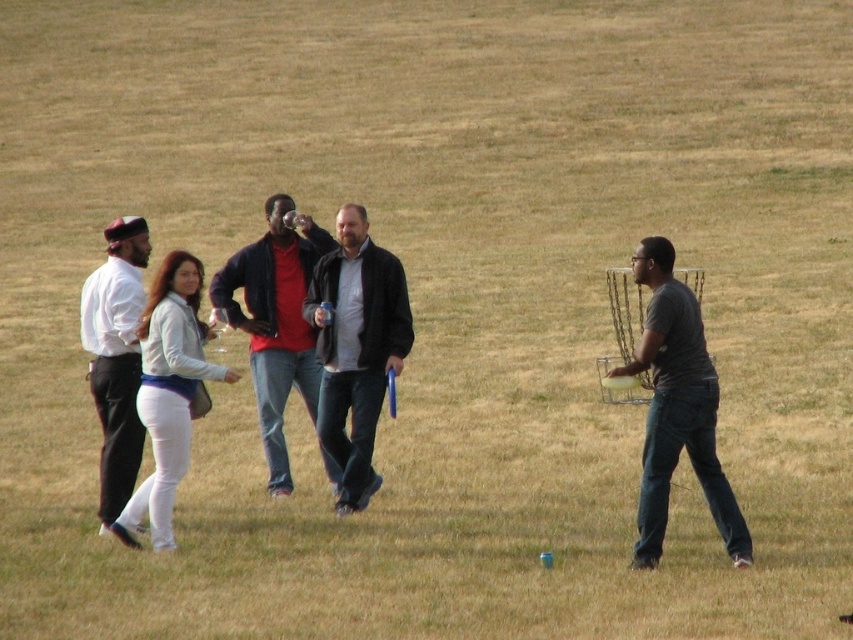
Question: Which of the following is the closest to the observer?

Choices:
 (A) (286, 346)
 (B) (140, 422)
 (C) (177, 317)
 (D) (639, 488)

Answer: (C)

Question: Which object is the closest to the dark gray jacket at center?

Choices:
 (A) gray matte t-shirt at right
 (B) white matte shirt at left
 (C) matte black jacket at center

Answer: (C)

Question: Where is dark gray jacket at center located in relation to matte black jacket at center in the image?

Choices:
 (A) left
 (B) right

Answer: (B)

Question: Can you confirm if gray matte t-shirt at right is smaller than white matte shirt at left?

Choices:
 (A) yes
 (B) no

Answer: (A)

Question: Can you confirm if gray matte t-shirt at right is positioned below dark gray jacket at center?

Choices:
 (A) no
 (B) yes

Answer: (B)

Question: Which point is closer to the camera taking this photo?

Choices:
 (A) (132, 474)
 (B) (701, 460)
 (C) (381, 257)
 (D) (294, 340)

Answer: (B)